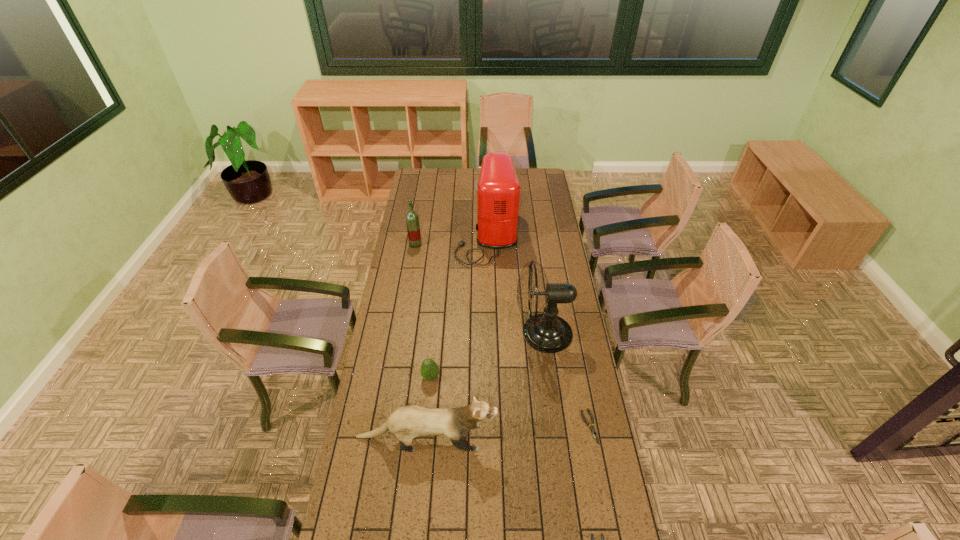
Locate which object ranks in proximity to the liquor. Please provide its 2D coordinates. Your answer should be formatted as a tuple, i.e. [(x, y)], where the tuple contains the x and y coordinates of a point satisfying the conditions above.

[(498, 188)]

Select which pliers is the second closest to the liquor. Please provide its 2D coordinates. Your answer should be formatted as a tuple, i.e. [(x, y)], where the tuple contains the x and y coordinates of a point satisfying the conditions above.

[(592, 536)]

Where is `free point that satisfies the following two spatial constraints: 1. on the back side of the farther pliers; 2. on the front-facing side of the kitchen mixer`? free point that satisfies the following two spatial constraints: 1. on the back side of the farther pliers; 2. on the front-facing side of the kitchen mixer is located at coordinates (553, 235).